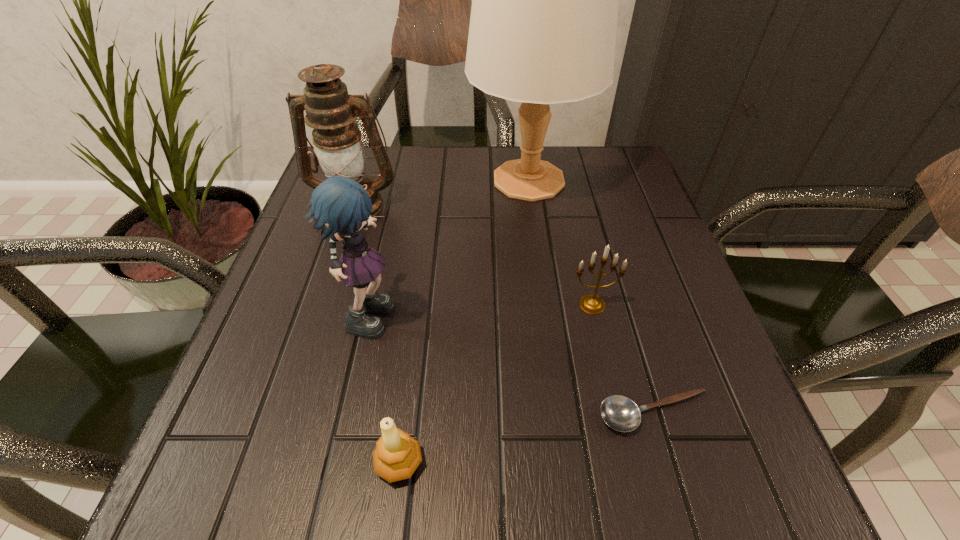
Identify the location of free space in the image that satisfies the following two spatial constraints: 1. on the front side of the ladle; 2. on the right side of the right candle_holder. (617, 414).

Where is `free space that satisfies the following two spatial constraints: 1. on the front side of the second nearest object; 2. on the right side of the third shortest object`? The image size is (960, 540). free space that satisfies the following two spatial constraints: 1. on the front side of the second nearest object; 2. on the right side of the third shortest object is located at coordinates (617, 414).

This screenshot has width=960, height=540. I want to click on free location that satisfies the following two spatial constraints: 1. on the front-facing side of the shorter candle_holder; 2. on the right side of the rag doll, so click(339, 463).